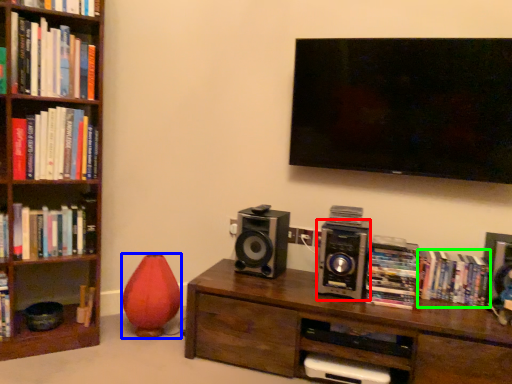
Question: Which object is the farthest from speaker (highlighted by a red box)? Choose among these: vase (highlighted by a blue box) or book (highlighted by a green box).

Choices:
 (A) vase
 (B) book

Answer: (A)